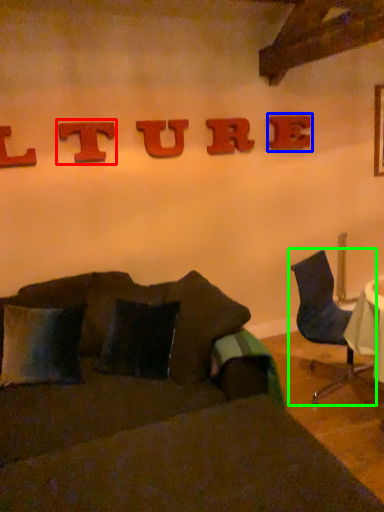
Question: Considering the real-world distances, which object is farthest from alphabet (highlighted by a red box)? alphabet (highlighted by a blue box) or chair (highlighted by a green box)?

Choices:
 (A) alphabet
 (B) chair

Answer: (B)